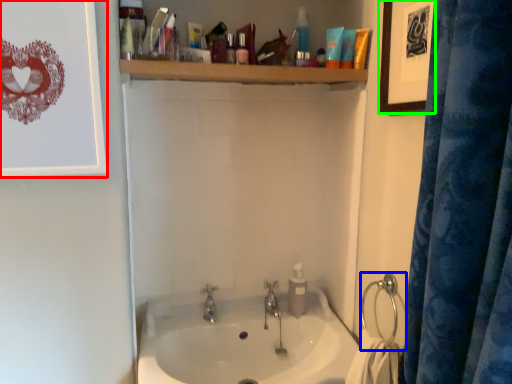
Question: Which object is the farthest from picture frame (highlighted by a red box)? Choose among these: shower (highlighted by a blue box) or picture frame (highlighted by a green box).

Choices:
 (A) shower
 (B) picture frame

Answer: (A)